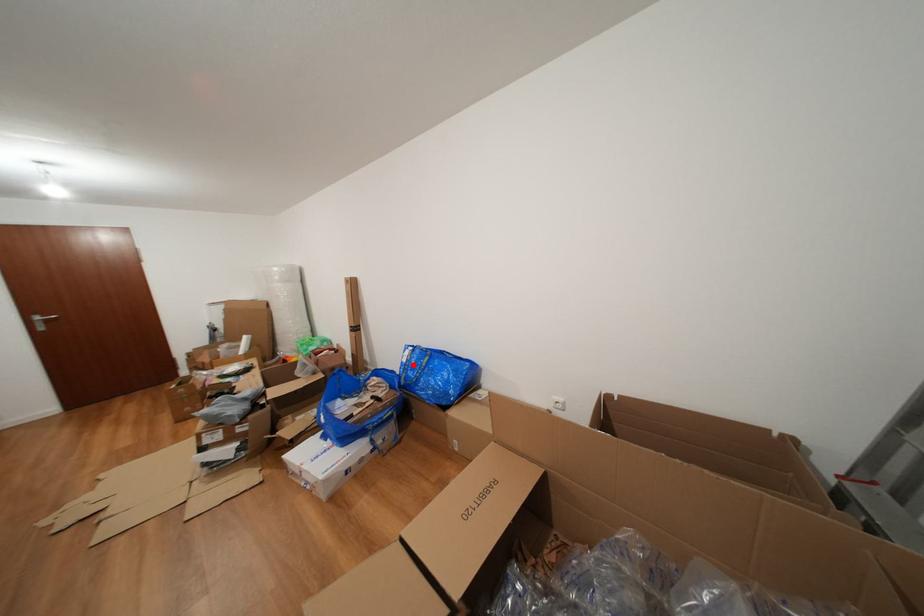
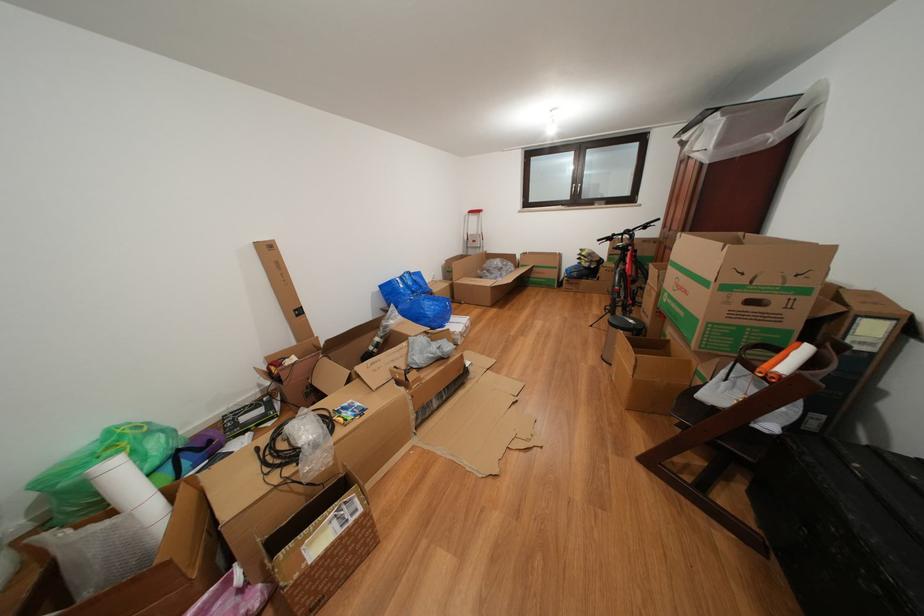
In the second image, find the point that corresponds to the highlighted location in the first image.

(409, 291)